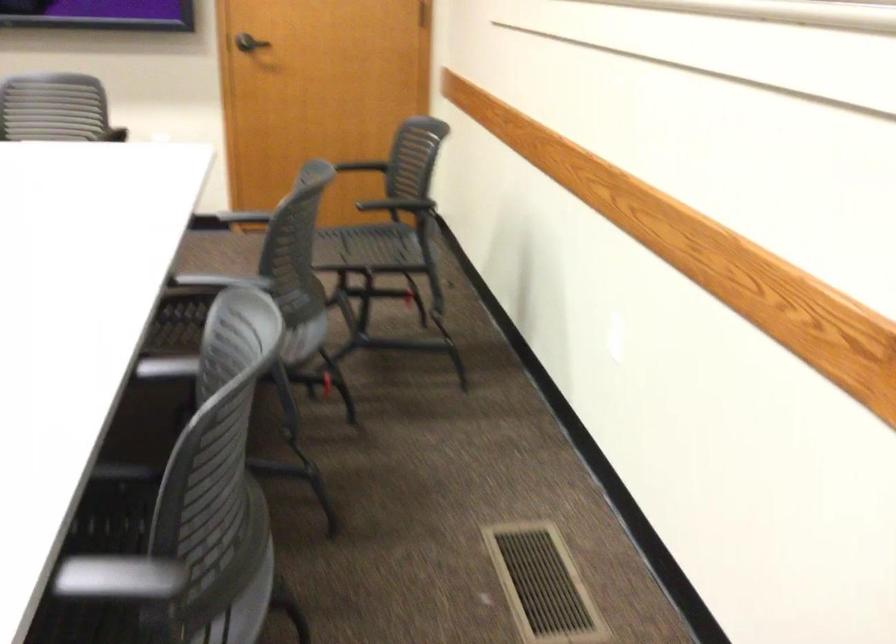
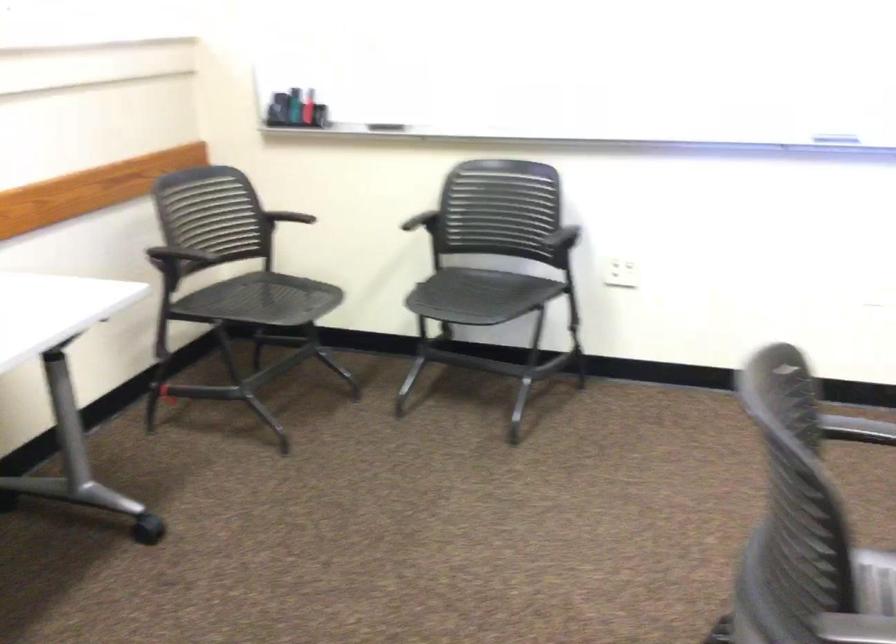
How did the camera likely rotate?

The camera's rotation is toward left-down.